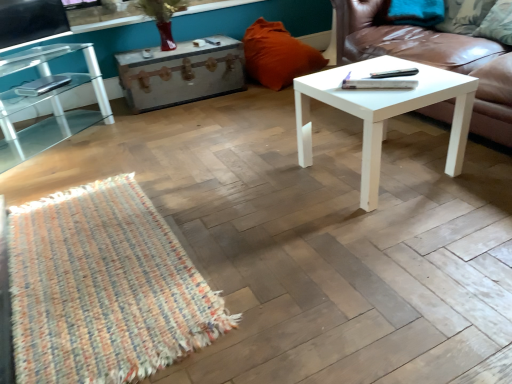
Locate an element on the screen. free spot in front of white matte coffee table at center is located at coordinates (397, 230).